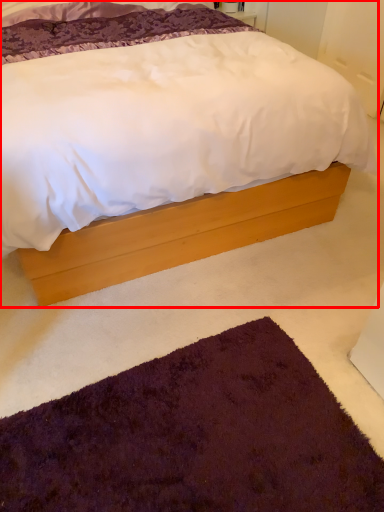
Question: Observing the image, what is the correct spatial positioning of bed (annotated by the red box) in reference to doormat?

Choices:
 (A) left
 (B) right

Answer: (A)